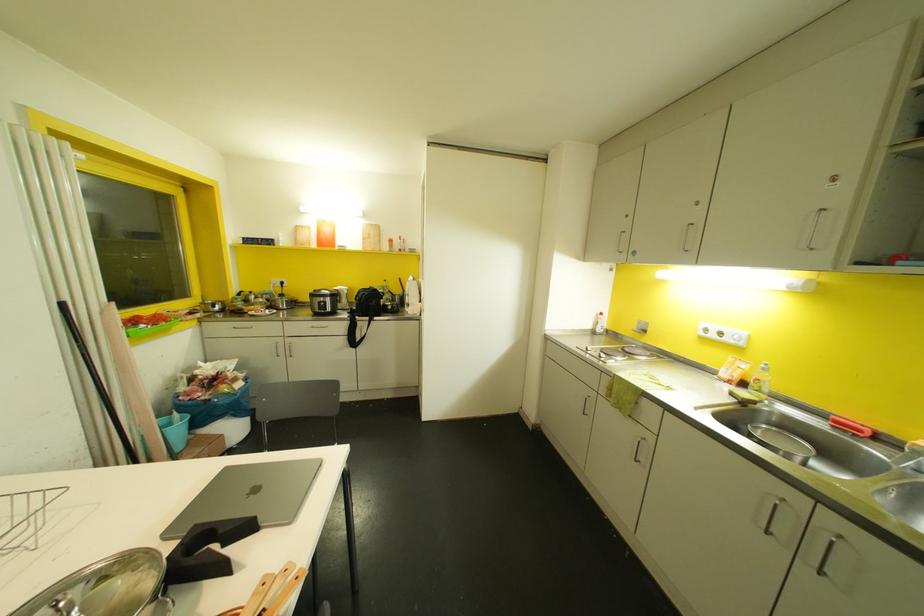
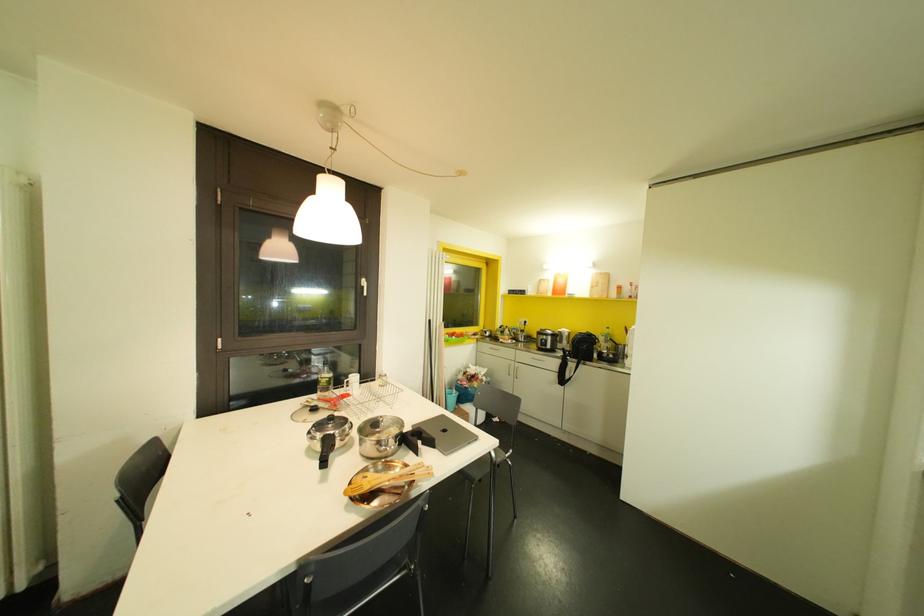
Question: The first image is from the beginning of the video and the second image is from the end. How did the camera likely rotate when shooting the video?

Choices:
 (A) Left
 (B) Right
 (C) Up
 (D) Down

Answer: (A)